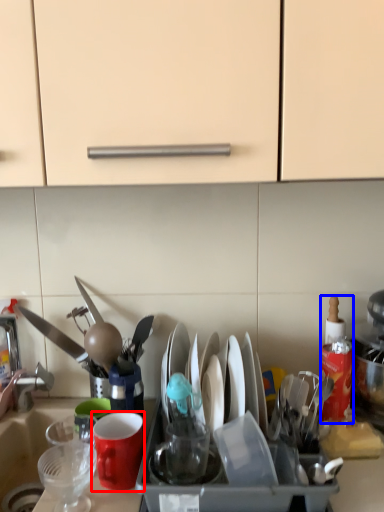
Question: Which object appears farthest to the camera in this image, coffee cup (highlighted by a red box) or bottle (highlighted by a blue box)?

Choices:
 (A) coffee cup
 (B) bottle

Answer: (B)